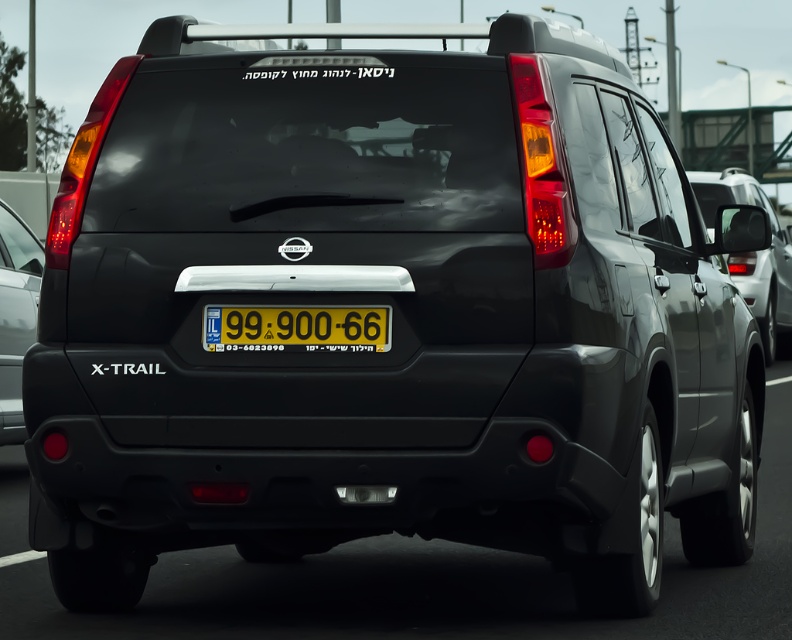
You are a parking attendant and need to guide a driver to park their car behind the existing vehicles. The driver is currently behind the satin black suv at right and the matte black tail light at lower left. Which vehicle should they move behind to ensure proper parking?

The driver should move behind the matte black tail light at lower left because the satin black suv at right is in front of it, so the tail light is further back and provides more space for parking.

You are a delivery robot that is 1.5 meters wide. You need to pass between the yellow plastic license plate at center and the matte black tail light at lower left. Is there enough space for you to fit through?

The distance between the yellow plastic license plate at center and the matte black tail light at lower left is 4.87 meters. Since the robot is 1.5 meters wide, there is sufficient space for it to pass through.